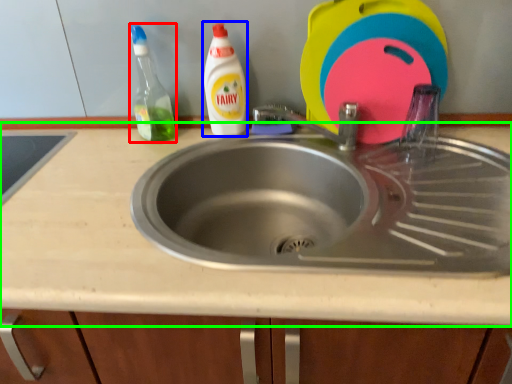
Question: Based on their relative distances, which object is farther from cleaning product (highlighted by a red box)? Choose from cleaning product (highlighted by a blue box) and countertop (highlighted by a green box).

Choices:
 (A) cleaning product
 (B) countertop

Answer: (B)